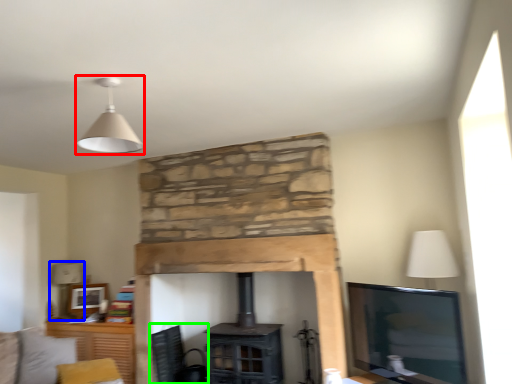
Question: Which object is positioned closest to lamp (highlighted by a red box)? Select from table lamp (highlighted by a blue box) and swivel chair (highlighted by a green box).

Choices:
 (A) table lamp
 (B) swivel chair

Answer: (B)